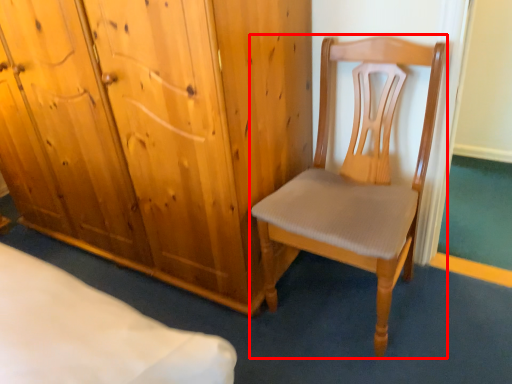
Question: In this image, where is chair (annotated by the red box) located relative to cupboard?

Choices:
 (A) left
 (B) right

Answer: (B)